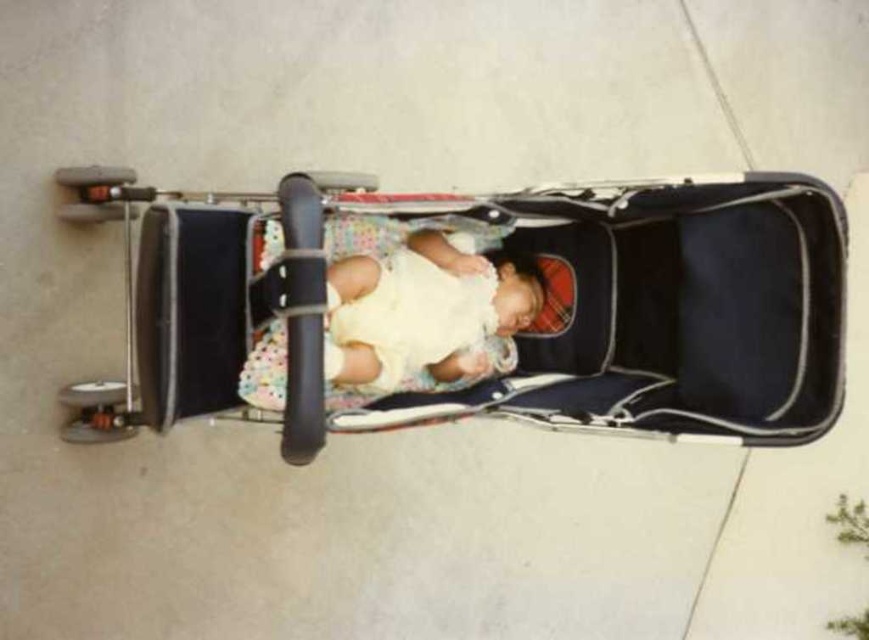
In the scene shown: How much distance is there between black fabric baby carriage at center and soft yellow fabric baby at center?

The distance of black fabric baby carriage at center from soft yellow fabric baby at center is 7.77 inches.

Does black fabric baby carriage at center have a lesser height compared to soft yellow fabric baby at center?

No.

Between point (85, 440) and point (347, 316), which one is positioned behind?

Point (85, 440)

You are a GUI agent. You are given a task and a screenshot of the screen. Output one action in this format:
    pyautogui.click(x=<x>, y=<y>)
    Task: Click on the black fabric baby carriage at center
    
    Given the screenshot: What is the action you would take?
    pyautogui.click(x=523, y=332)